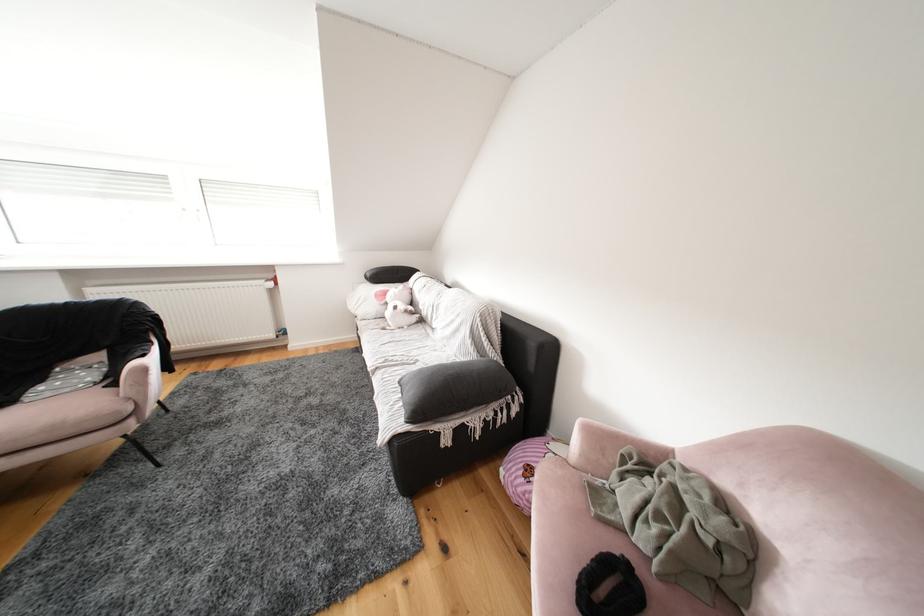
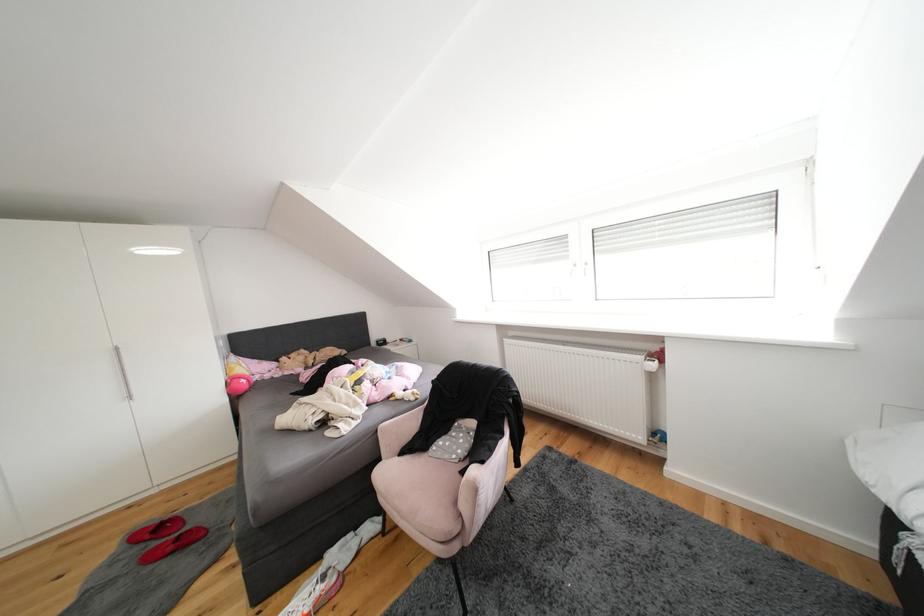
Find the pixel in the second image that matches the point at 152,360 in the first image.

(492, 466)